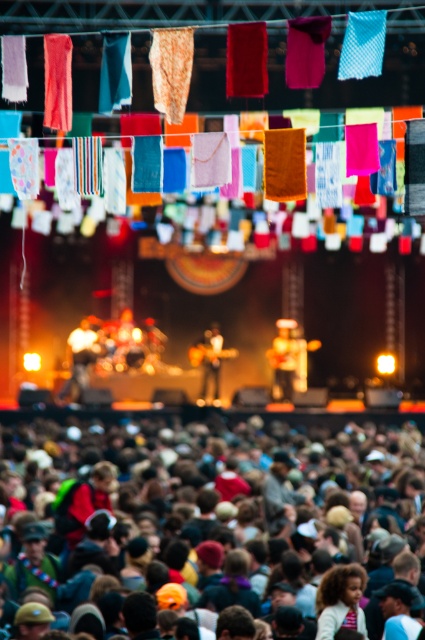
Question: Which object is farther from the camera taking this photo?

Choices:
 (A) matte brown guitar at center
 (B) multicolored fabric at lower center

Answer: (A)

Question: Which of the following is the farthest from the observer?

Choices:
 (A) (79, 337)
 (B) (280, 355)
 (C) (195, 349)

Answer: (A)

Question: Which object is positioned farthest from the multicolored fabric at lower center?

Choices:
 (A) matte black guitar at center
 (B) matte brown guitar at center

Answer: (A)

Question: Is multicolored fabric at lower center above matte black guitar at center?

Choices:
 (A) yes
 (B) no

Answer: (B)

Question: Is matte brown guitar at center below wooden guitar at center?

Choices:
 (A) no
 (B) yes

Answer: (B)

Question: Is multicolored fabric at lower center to the right of matte black guitar at center from the viewer's perspective?

Choices:
 (A) yes
 (B) no

Answer: (A)